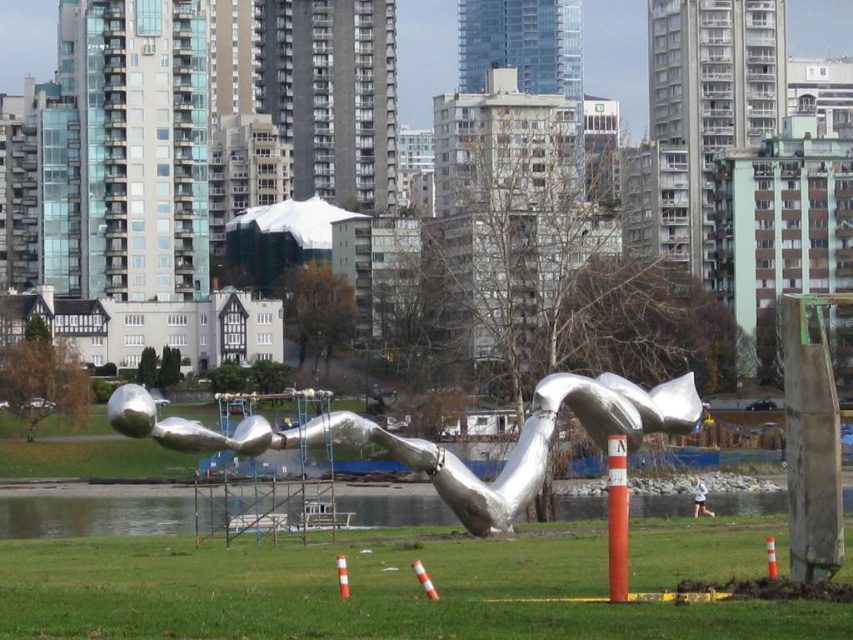
Which is more to the right, green grass at center or orange striped traffic cone at center?

Positioned to the right is green grass at center.

Does point (714, 554) come in front of point (345, 586)?

No, it is not.

Does point (564, 634) lie behind point (343, 595)?

No, it is in front of (343, 595).

Identify the location of green grass at center. (360, 593).

Is orange reflective cone at center above orange traffic cone at center?

Incorrect, orange reflective cone at center is not positioned above orange traffic cone at center.

Does orange reflective cone at center have a smaller size compared to orange traffic cone at center?

No, orange reflective cone at center is not smaller than orange traffic cone at center.

The width and height of the screenshot is (853, 640). What do you see at coordinates (424, 579) in the screenshot?
I see `orange reflective cone at center` at bounding box center [424, 579].

Find the location of `orange reflective cone at center`. orange reflective cone at center is located at coordinates (424, 579).

Can you confirm if orange matte pole at center is bigger than orange traffic cone at center?

Correct, orange matte pole at center is larger in size than orange traffic cone at center.

In the scene shown: Can you confirm if orange matte pole at center is wider than orange traffic cone at center?

Yes.

Who is more distant from viewer, (619, 451) or (767, 557)?

The point (767, 557) is more distant.

I want to click on orange matte pole at center, so click(618, 518).